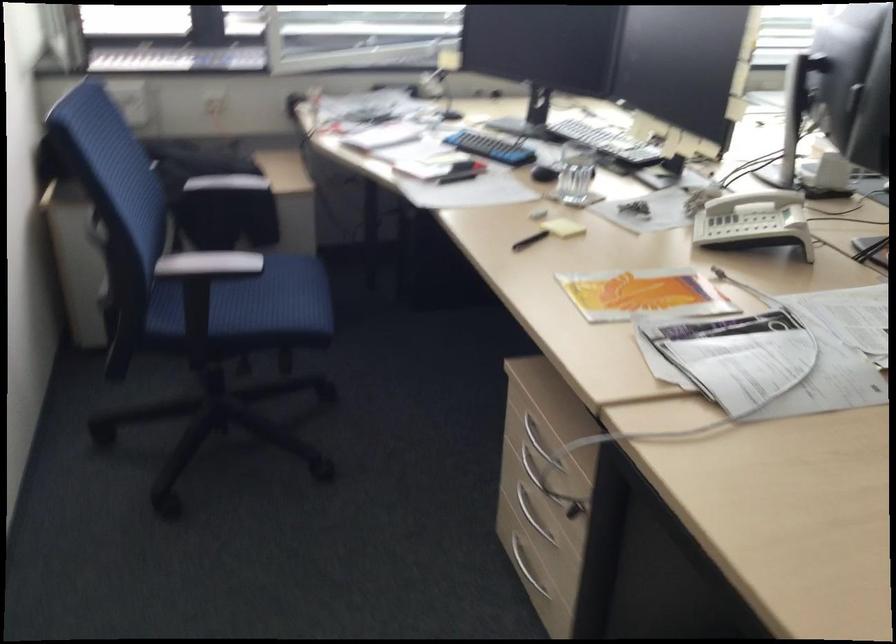
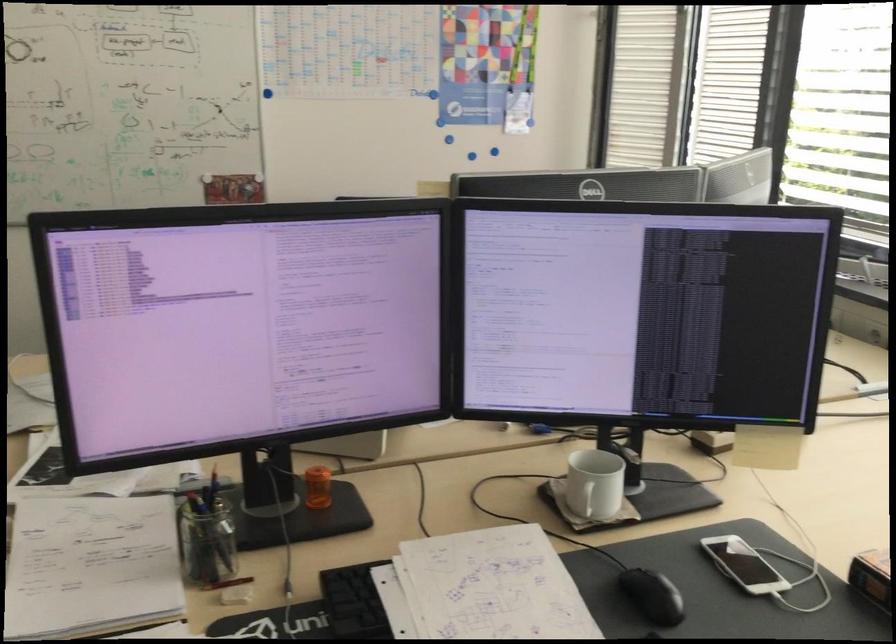
Question: I am providing you with two images of the same scene from different viewpoints. Please identify which objects are invisible in image2.

Choices:
 (A) black computer mouse
 (B) blue chair sitting surface
 (C) glass pencil holder
 (D) yellow snack package

Answer: (B)